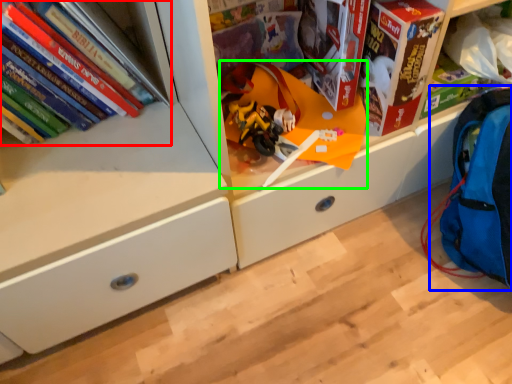
Question: Which is nearer to the book (highlighted by a red box)? backpack (highlighted by a blue box) or toy (highlighted by a green box).

Choices:
 (A) backpack
 (B) toy

Answer: (B)